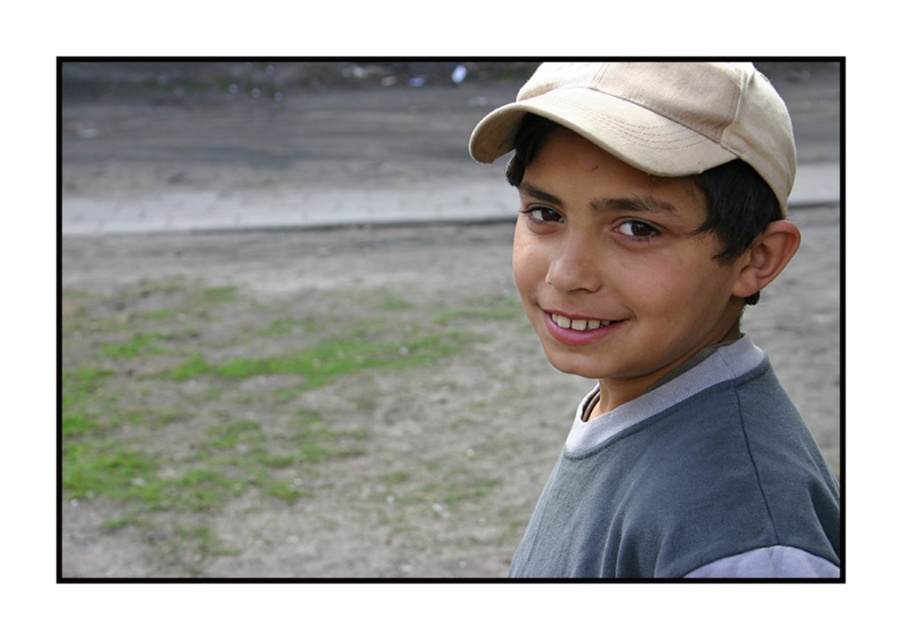
How distant is matte gray shirt at center from beige fabric baseball cap at upper right?

matte gray shirt at center and beige fabric baseball cap at upper right are 7.03 inches apart.

Is matte gray shirt at center thinner than beige fabric baseball cap at upper right?

Incorrect, matte gray shirt at center's width is not less than beige fabric baseball cap at upper right's.

Describe the element at coordinates (661, 321) in the screenshot. I see `matte gray shirt at center` at that location.

This screenshot has width=902, height=640. I want to click on matte gray shirt at center, so click(x=661, y=321).